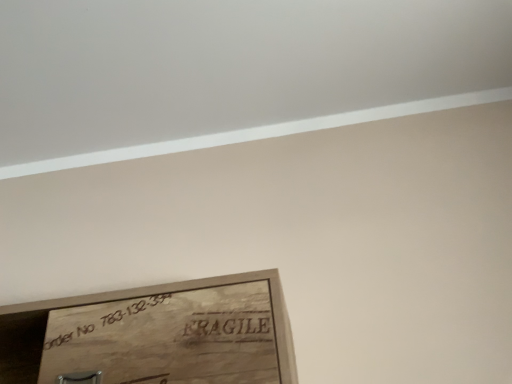
In order to face wooden plaque at lower left, should I rotate leftwards or rightwards?

You should rotate left by 18.235 degrees.

The image size is (512, 384). I want to click on wooden plaque at lower left, so click(176, 334).

Describe the element at coordinates (176, 334) in the screenshot. I see `wooden plaque at lower left` at that location.

Measure the distance between wooden plaque at lower left and camera.

A distance of 24.76 inches exists between wooden plaque at lower left and camera.

The image size is (512, 384). In order to click on wooden plaque at lower left in this screenshot , I will do `click(176, 334)`.